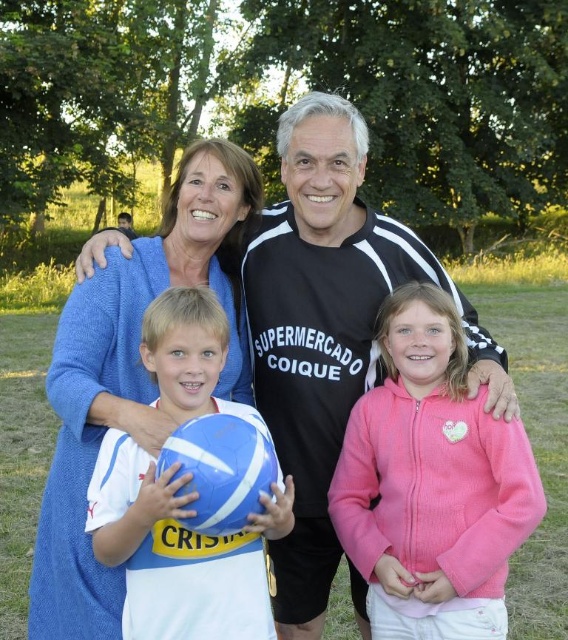
Question: Among these points, which one is farthest from the camera?

Choices:
 (A) (517, 515)
 (B) (204, 589)
 (C) (56, 554)

Answer: (C)

Question: Considering the relative positions of pink fleece jacket at center and blue wool sweater at upper left in the image provided, where is pink fleece jacket at center located with respect to blue wool sweater at upper left?

Choices:
 (A) left
 (B) right

Answer: (B)

Question: Which of the following is the farthest from the observer?

Choices:
 (A) (311, 186)
 (B) (396, 486)

Answer: (A)

Question: Does white matte jersey at center appear on the right side of blue rubber beach ball at center?

Choices:
 (A) yes
 (B) no

Answer: (B)

Question: Which of the following is the farthest from the observer?

Choices:
 (A) white matte jersey at center
 (B) black jersey at center
 (C) blue rubber beach ball at center
 (D) blue wool sweater at upper left

Answer: (B)

Question: From the image, what is the correct spatial relationship of pink fleece jacket at center in relation to blue wool sweater at upper left?

Choices:
 (A) right
 (B) left

Answer: (A)